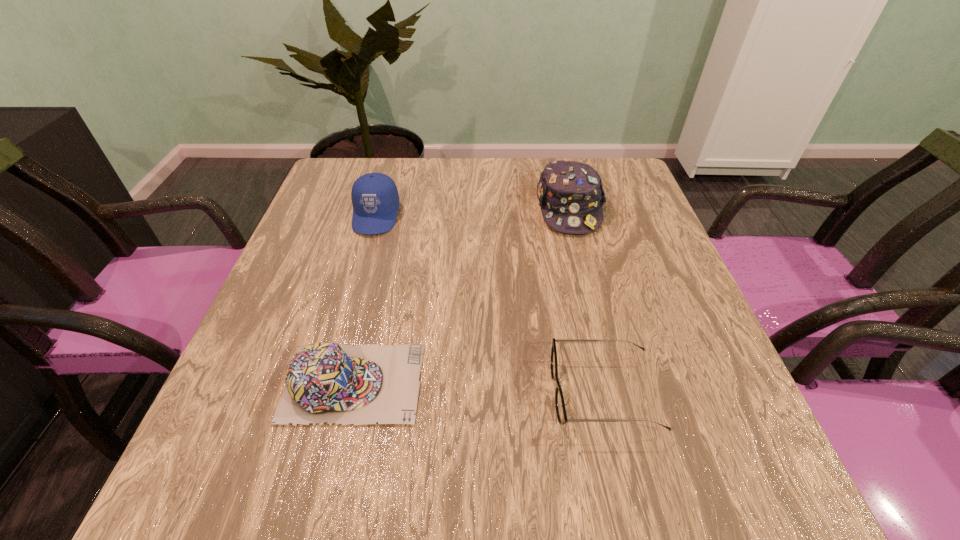
Locate an element on the screen. spectacles located at the right edge is located at coordinates (561, 413).

This screenshot has width=960, height=540. Find the location of `object that is at the far left corner`. object that is at the far left corner is located at coordinates (375, 198).

The image size is (960, 540). I want to click on object that is at the far right corner, so click(x=570, y=194).

The height and width of the screenshot is (540, 960). Identify the location of vacant area at the far edge of the desktop. (459, 192).

Find the location of a particular element. The height and width of the screenshot is (540, 960). vacant space at the near edge of the desktop is located at coordinates (608, 455).

The image size is (960, 540). I want to click on vacant space at the left edge of the desktop, so click(x=343, y=210).

The height and width of the screenshot is (540, 960). In order to click on free space at the right edge of the desktop in this screenshot , I will do `click(644, 314)`.

I want to click on vacant space at the far right corner, so click(x=621, y=174).

You are a GUI agent. You are given a task and a screenshot of the screen. Output one action in this format:
    pyautogui.click(x=<x>, y=<y>)
    Task: Click on the free space between the rightmost cap and the third tallest object
    This screenshot has height=540, width=960.
    Given the screenshot: What is the action you would take?
    pyautogui.click(x=461, y=296)

Image resolution: width=960 pixels, height=540 pixels. I want to click on vacant point located between the spectacles and the rightmost cap, so click(587, 301).